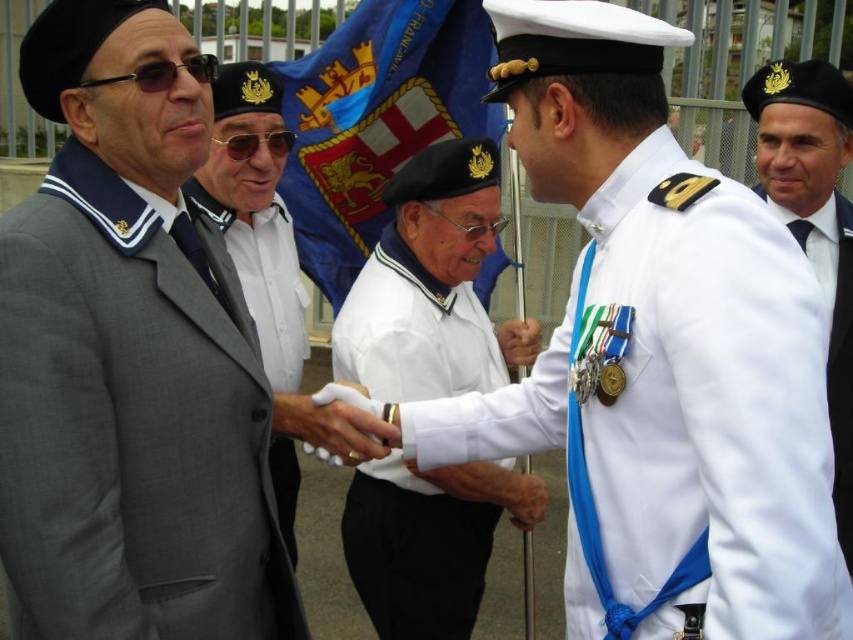
Question: Is blue fabric flag at center further to the viewer compared to white leather hand at center?

Choices:
 (A) no
 (B) yes

Answer: (B)

Question: Does white uniform at center have a greater width compared to white matte shirt at center?

Choices:
 (A) no
 (B) yes

Answer: (B)

Question: Which object is farther from the camera taking this photo?

Choices:
 (A) gray wool suit at left
 (B) blue fabric flag at center

Answer: (B)

Question: Which point is closer to the camera taking this photo?

Choices:
 (A) (438, 509)
 (B) (346, 81)
 (C) (99, 563)

Answer: (C)

Question: Is white uniform at center bigger than matte gray suit at left?

Choices:
 (A) yes
 (B) no

Answer: (A)

Question: Which point is farther to the camera?

Choices:
 (A) (264, 266)
 (B) (850, 394)
 (C) (360, 428)

Answer: (A)